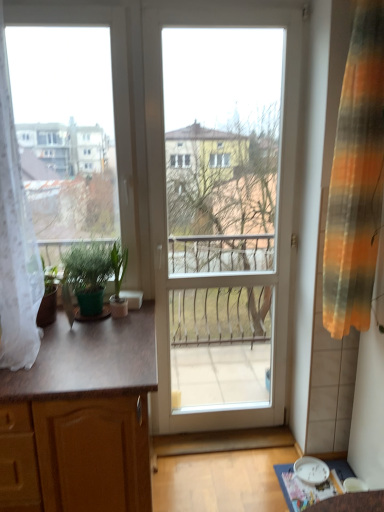
Question: Looking at their shapes, would you say green matte plant at left, marked as the 2th houseplant in a right-to-left arrangement, is wider or thinner than green matte plant at left, which is the 1th houseplant in right-to-left order?

Choices:
 (A) wide
 (B) thin

Answer: (A)

Question: Is point (89, 256) closer or farther from the camera than point (109, 300)?

Choices:
 (A) closer
 (B) farther

Answer: (A)

Question: Estimate the real-world distances between objects in this image. Which object is closer to the wooden cabinet at left?

Choices:
 (A) green matte plant at left, which is the 1th houseplant in right-to-left order
 (B) green matte plant at left, which is the 1th houseplant in left-to-right order
 (C) white glossy door at center
 (D) transparent glass window screen at left
 (E) white lace curtain at left, acting as the second curtain starting from the right

Answer: (E)

Question: Which object is the farthest from the white glossy door at center?

Choices:
 (A) white lace curtain at left, acting as the second curtain starting from the right
 (B) wooden cabinet at left
 (C) transparent glass window screen at left
 (D) green matte plant at left, marked as the 2th houseplant in a right-to-left arrangement
 (E) striped fabric curtain at right, the 2th curtain in the left-to-right sequence

Answer: (A)